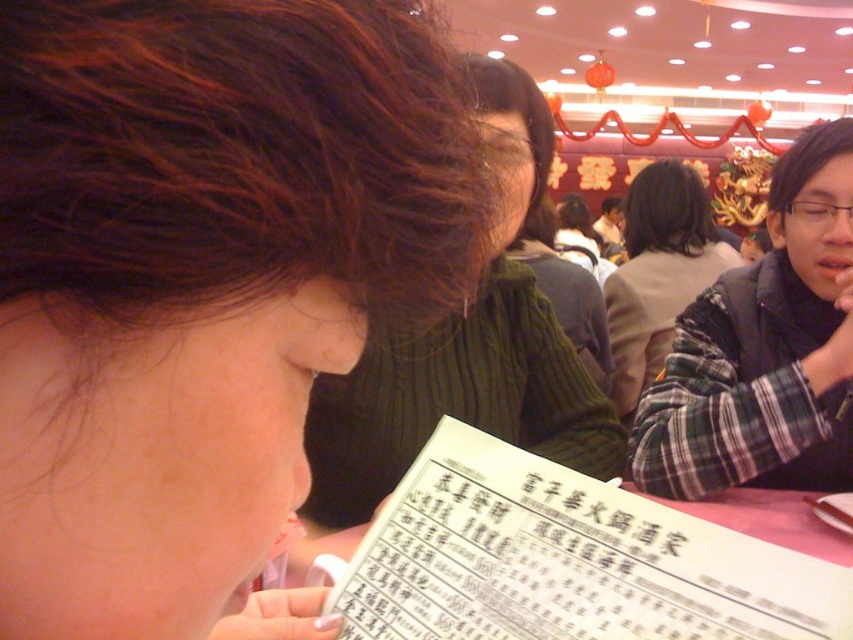
Is white paper menu at center above green knitted sweater at center?

No, white paper menu at center is not above green knitted sweater at center.

From the picture: Can you confirm if white paper menu at center is shorter than green knitted sweater at center?

Indeed, white paper menu at center has a lesser height compared to green knitted sweater at center.

At what (x,y) coordinates should I click in order to perform the action: click on white paper menu at center. Please return your answer as a coordinate pair (x, y). Image resolution: width=853 pixels, height=640 pixels. Looking at the image, I should click on (572, 564).

At what (x,y) coordinates should I click in order to perform the action: click on white paper menu at center. Please return your answer as a coordinate pair (x, y). This screenshot has width=853, height=640. Looking at the image, I should click on (572, 564).

The height and width of the screenshot is (640, 853). Describe the element at coordinates (199, 278) in the screenshot. I see `brown matte hair at upper left` at that location.

The image size is (853, 640). I want to click on brown matte hair at upper left, so click(x=199, y=278).

Who is higher up, brown matte hair at upper left or white paper menu at center?

brown matte hair at upper left is higher up.

Which is in front, point (457, 257) or point (555, 576)?

Positioned in front is point (457, 257).

Which is behind, point (392, 225) or point (599, 499)?

Point (599, 499)

This screenshot has width=853, height=640. I want to click on brown matte hair at upper left, so click(x=199, y=278).